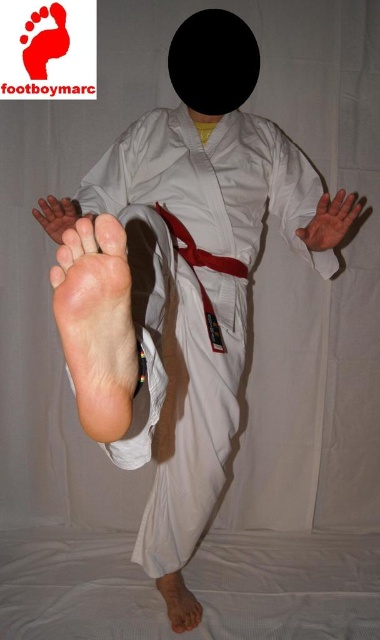
Question: Where is white cotton kimono at center located in relation to pinkish matte skin at lower center in the image?

Choices:
 (A) left
 (B) right

Answer: (A)

Question: Which point is farther from the camera taking this photo?

Choices:
 (A) (104, 282)
 (B) (167, 573)
 (C) (210, 449)

Answer: (B)

Question: Which point is farther from the camera taking this photo?

Choices:
 (A) (148, 115)
 (B) (171, 604)

Answer: (B)

Question: Among these points, which one is nearest to the camera?

Choices:
 (A) (201, 376)
 (B) (167, 582)

Answer: (A)

Question: Does pale skin foot at center appear over pinkish matte skin at lower center?

Choices:
 (A) no
 (B) yes

Answer: (B)

Question: Does white cotton kimono at center appear over pale skin foot at center?

Choices:
 (A) yes
 (B) no

Answer: (B)